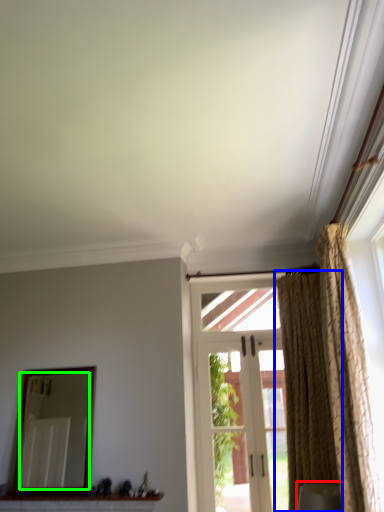
Question: Based on their relative distances, which object is nearer to furniture (highlighted by a red box)? Choose from curtain (highlighted by a blue box) and mirror (highlighted by a green box).

Choices:
 (A) curtain
 (B) mirror

Answer: (A)